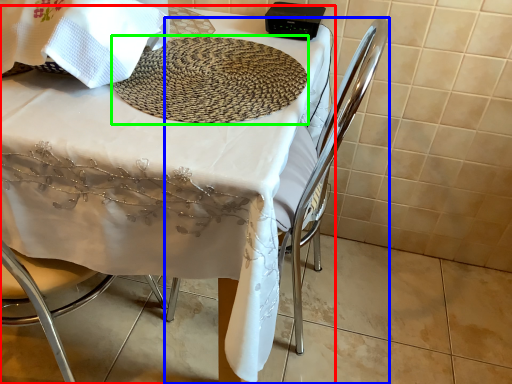
Question: Considering the real-world distances, which object is farthest from table (highlighted by a red box)? chair (highlighted by a blue box) or mat (highlighted by a green box)?

Choices:
 (A) chair
 (B) mat

Answer: (A)